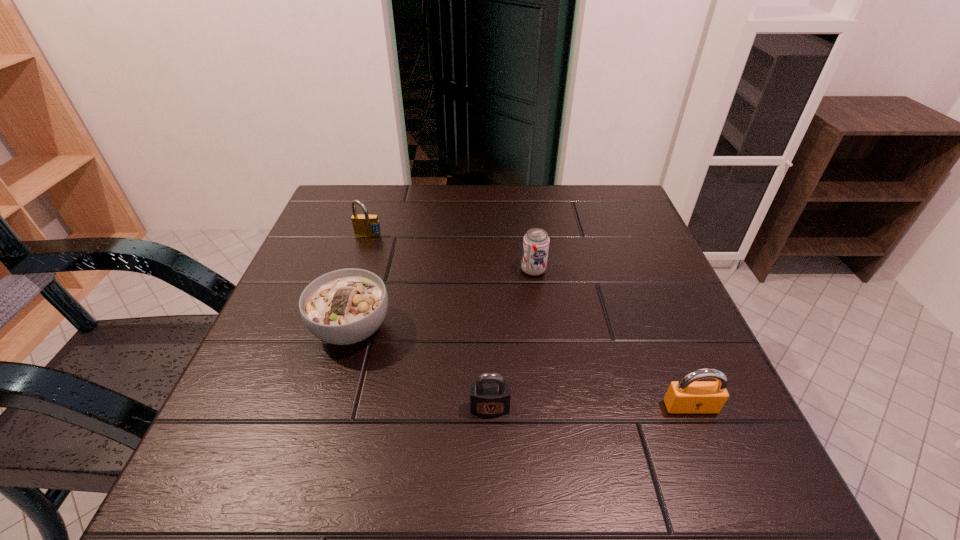
This screenshot has width=960, height=540. Find the location of `vacant space at the right edge`. vacant space at the right edge is located at coordinates (667, 311).

Image resolution: width=960 pixels, height=540 pixels. In order to click on vacant space at the far left corner in this screenshot , I will do `click(359, 207)`.

This screenshot has width=960, height=540. In the image, there is a desktop. What are the coordinates of `vacant space at the near left corner` in the screenshot? It's located at [216, 502].

Find the location of a particular element. This screenshot has height=540, width=960. free space at the far right corner of the desktop is located at coordinates (630, 194).

Where is `empty space between the third object from right to left and the leftmost padlock`? empty space between the third object from right to left and the leftmost padlock is located at coordinates (429, 322).

The image size is (960, 540). What are the coordinates of `vacant area that lies between the rightmost object and the farthest object` in the screenshot? It's located at (529, 322).

Where is `vacant area between the second padlock from right to left and the rightmost padlock`? vacant area between the second padlock from right to left and the rightmost padlock is located at coordinates (590, 407).

Image resolution: width=960 pixels, height=540 pixels. I want to click on empty location between the rightmost object and the second object from right to left, so click(x=612, y=339).

Image resolution: width=960 pixels, height=540 pixels. I want to click on free space between the soup bowl and the second object from right to left, so click(x=443, y=299).

The width and height of the screenshot is (960, 540). Identify the location of blank region between the farthest object and the rightmost padlock. [529, 322].